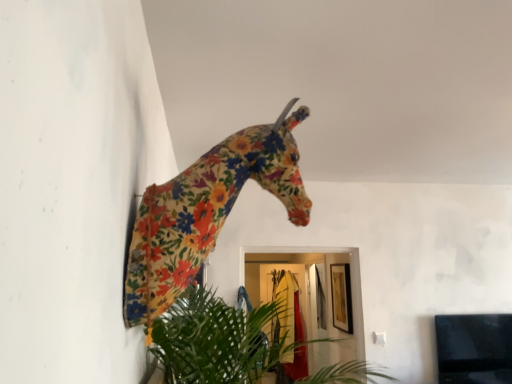
Question: Considering the positions of green leafy plant at lower center and floral fabric giraffe at upper center in the image, is green leafy plant at lower center wider or thinner than floral fabric giraffe at upper center?

Choices:
 (A) wide
 (B) thin

Answer: (A)

Question: Relative to floral fabric giraffe at upper center, is green leafy plant at lower center in front or behind?

Choices:
 (A) front
 (B) behind

Answer: (B)

Question: Visually, is green leafy plant at lower center positioned to the left or to the right of floral fabric giraffe at upper center?

Choices:
 (A) left
 (B) right

Answer: (B)

Question: Is floral fabric giraffe at upper center spatially inside green leafy plant at lower center, or outside of it?

Choices:
 (A) inside
 (B) outside

Answer: (B)

Question: In the image, is floral fabric giraffe at upper center on the left side or the right side of green leafy plant at lower center?

Choices:
 (A) left
 (B) right

Answer: (A)

Question: In terms of width, does floral fabric giraffe at upper center look wider or thinner when compared to green leafy plant at lower center?

Choices:
 (A) wide
 (B) thin

Answer: (B)

Question: Looking at the image, does floral fabric giraffe at upper center seem bigger or smaller compared to green leafy plant at lower center?

Choices:
 (A) small
 (B) big

Answer: (A)